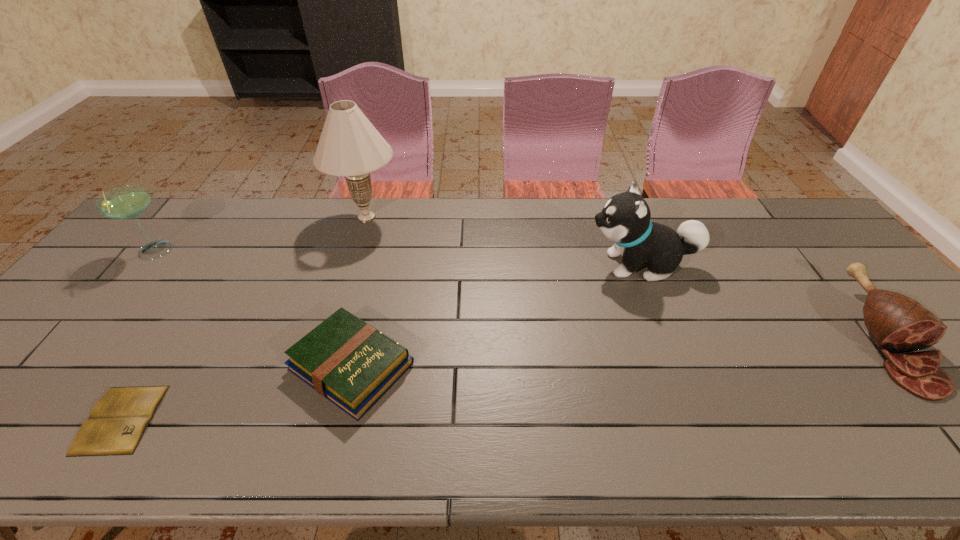
Image resolution: width=960 pixels, height=540 pixels. I want to click on unoccupied position between the left book and the fifth tallest object, so click(x=236, y=393).

Find the location of a particular element. The width and height of the screenshot is (960, 540). unoccupied position between the right book and the puppy is located at coordinates (496, 315).

Identify which object is the fifth closest to the puppy. Please provide its 2D coordinates. Your answer should be formatted as a tuple, i.e. [(x, y)], where the tuple contains the x and y coordinates of a point satisfying the conditions above.

[(127, 202)]

Locate an element on the screen. The width and height of the screenshot is (960, 540). the fourth closest object relative to the right book is located at coordinates (127, 202).